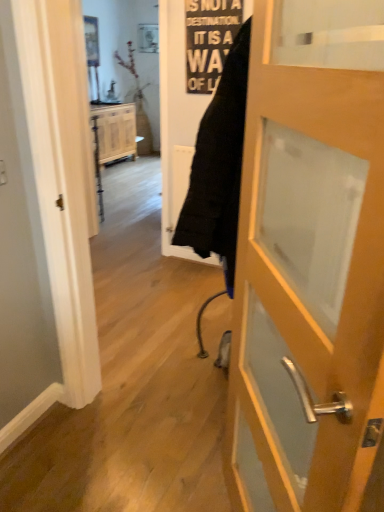
Question: From a real-world perspective, is black paper sign at upper center beneath wooden door at center?

Choices:
 (A) yes
 (B) no

Answer: (B)

Question: Is black paper sign at upper center positioned behind wooden door at center?

Choices:
 (A) yes
 (B) no

Answer: (A)

Question: From the image's perspective, is black paper sign at upper center located beneath wooden door at center?

Choices:
 (A) no
 (B) yes

Answer: (A)

Question: From the image's perspective, is black paper sign at upper center over wooden door at center?

Choices:
 (A) yes
 (B) no

Answer: (A)

Question: Is there a large distance between black paper sign at upper center and wooden door at center?

Choices:
 (A) yes
 (B) no

Answer: (A)

Question: Is black paper sign at upper center bigger than wooden door at center?

Choices:
 (A) no
 (B) yes

Answer: (A)

Question: Is wooden door at center aimed at black paper sign at upper center?

Choices:
 (A) no
 (B) yes

Answer: (A)

Question: Is wooden door at center facing away from black paper sign at upper center?

Choices:
 (A) no
 (B) yes

Answer: (A)

Question: Considering the relative sizes of wooden door at center and black paper sign at upper center in the image provided, is wooden door at center smaller than black paper sign at upper center?

Choices:
 (A) yes
 (B) no

Answer: (B)

Question: From a real-world perspective, is wooden door at center over black paper sign at upper center?

Choices:
 (A) no
 (B) yes

Answer: (A)

Question: From a real-world perspective, is wooden door at center located beneath black paper sign at upper center?

Choices:
 (A) no
 (B) yes

Answer: (B)

Question: Is wooden door at center positioned before black paper sign at upper center?

Choices:
 (A) yes
 (B) no

Answer: (A)

Question: From a real-world perspective, is wooden cabinet at center under black paper sign at upper center?

Choices:
 (A) yes
 (B) no

Answer: (A)